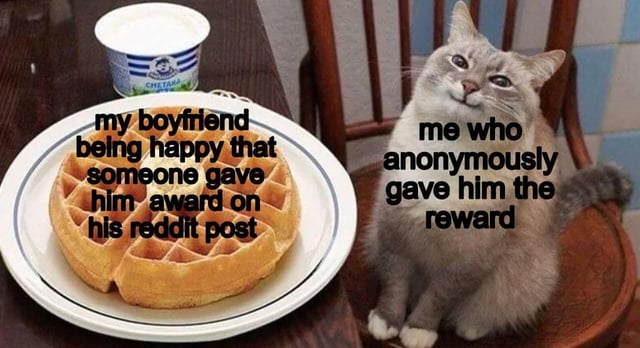
Image resolution: width=640 pixels, height=348 pixels. I want to click on plate, so click(45, 254).